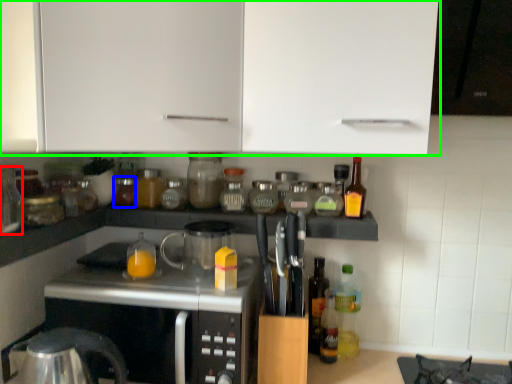
Question: Which is nearer to the bottle (highlighted by a red box)? bottle (highlighted by a blue box) or cabinetry (highlighted by a green box).

Choices:
 (A) bottle
 (B) cabinetry

Answer: (A)